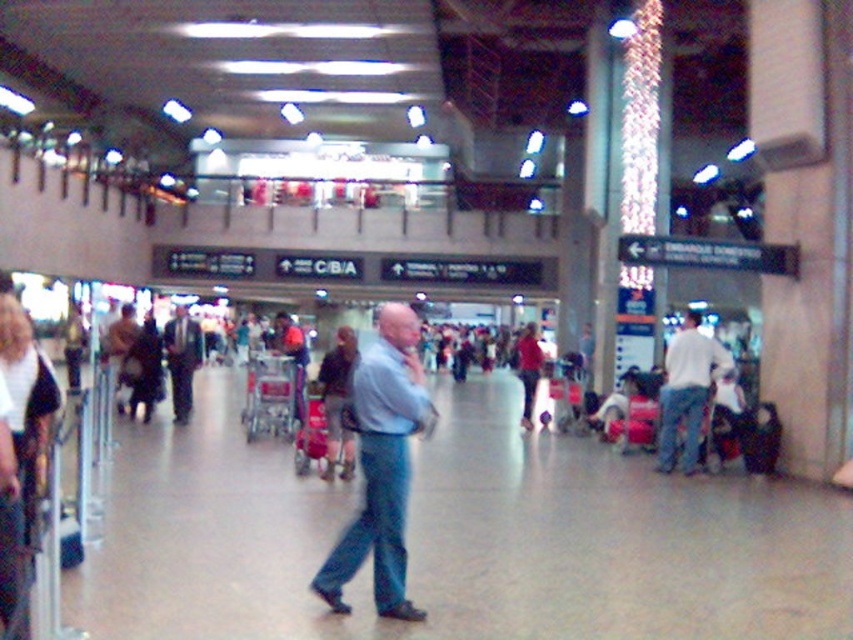
Question: Among these points, which one is nearest to the camera?

Choices:
 (A) click(x=347, y=436)
 (B) click(x=758, y=426)

Answer: (A)

Question: Does white cotton shirt at center appear on the left side of dark gray suit at center?

Choices:
 (A) no
 (B) yes

Answer: (A)

Question: Does blue denim jeans at center appear on the right side of white cotton shirt at center?

Choices:
 (A) no
 (B) yes

Answer: (A)

Question: From the image, what is the correct spatial relationship of light blue shirt at center in relation to blue denim jeans at center?

Choices:
 (A) below
 (B) above

Answer: (B)

Question: Among these points, which one is nearest to the camera?

Choices:
 (A) tap(381, 308)
 (B) tap(773, 445)
 (C) tap(683, 317)

Answer: (B)

Question: Which is farther from the dark gray sweater at center?

Choices:
 (A) blue denim jeans at center
 (B) matte black suitcase at lower right
 (C) light blue shirt at center
 (D) white cotton shirt at center

Answer: (B)